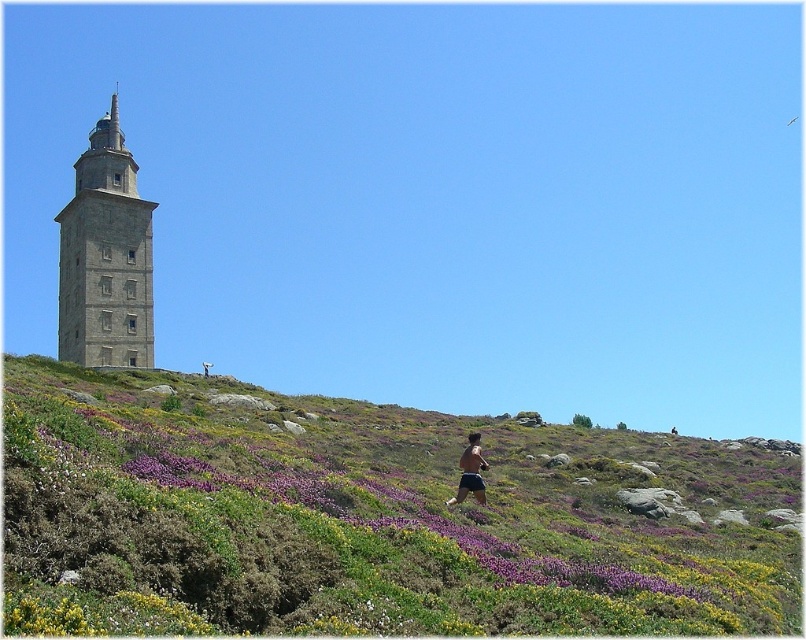
Who is more forward, (239, 554) or (476, 461)?

Point (239, 554) is in front.

Find the location of a particular element. This screenshot has height=640, width=806. purple grass at upper center is located at coordinates (376, 518).

Is point (111, 413) farther from camera compared to point (470, 442)?

No, it is in front of (470, 442).

The image size is (806, 640). I want to click on purple grass at upper center, so click(376, 518).

Is stone tower at left to the left of skinny man at lower center from the viewer's perspective?

Yes, stone tower at left is to the left of skinny man at lower center.

Who is more distant from viewer, [123,230] or [484,468]?

The point [123,230] is more distant.

Find the location of a particular element. stone tower at left is located at coordinates (106, 257).

Who is shorter, purple grass at upper center or stone tower at left?

purple grass at upper center

Between purple grass at upper center and stone tower at left, which one is positioned lower?

purple grass at upper center

Which is in front, point (243, 570) or point (139, 282)?

Point (243, 570) is more forward.

The width and height of the screenshot is (806, 640). What are the coordinates of `purple grass at upper center` in the screenshot? It's located at (376, 518).